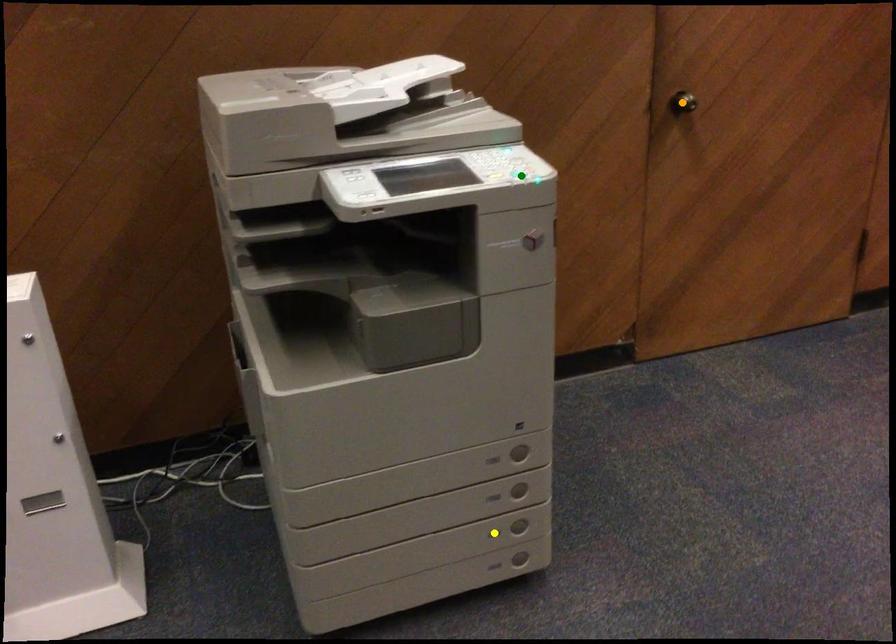
Order these from nearest to farthest:
yellow point, green point, orange point

green point < yellow point < orange point